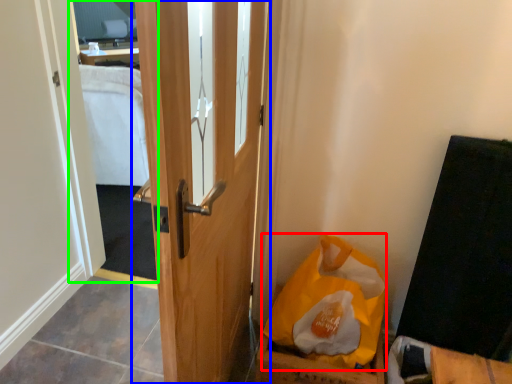
Question: Which object is positioned farthest from paper bag (highlighted by a red box)? Select from door (highlighted by a blue box) and mirror (highlighted by a green box).

Choices:
 (A) door
 (B) mirror

Answer: (B)